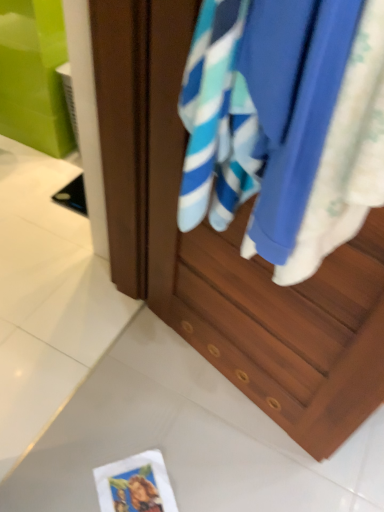
The height and width of the screenshot is (512, 384). I want to click on vacant point to the left of white paper postcard at lower center, so click(70, 470).